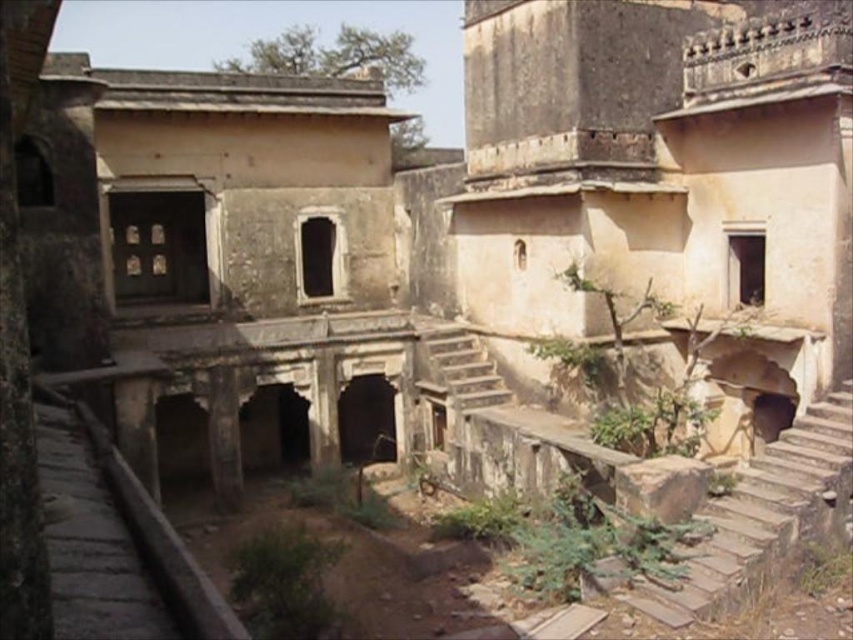
Question: Does rustic stone stairs at lower right have a lesser width compared to rustic stone stairs at center?

Choices:
 (A) no
 (B) yes

Answer: (B)

Question: Which point is farther from the camera taking this photo?

Choices:
 (A) (776, 518)
 (B) (444, 324)

Answer: (B)

Question: From the image, what is the correct spatial relationship of rustic stone stairs at lower right in relation to rustic stone stairs at center?

Choices:
 (A) right
 (B) left

Answer: (A)

Question: Does rustic stone stairs at lower right have a smaller size compared to rustic stone stairs at center?

Choices:
 (A) no
 (B) yes

Answer: (B)